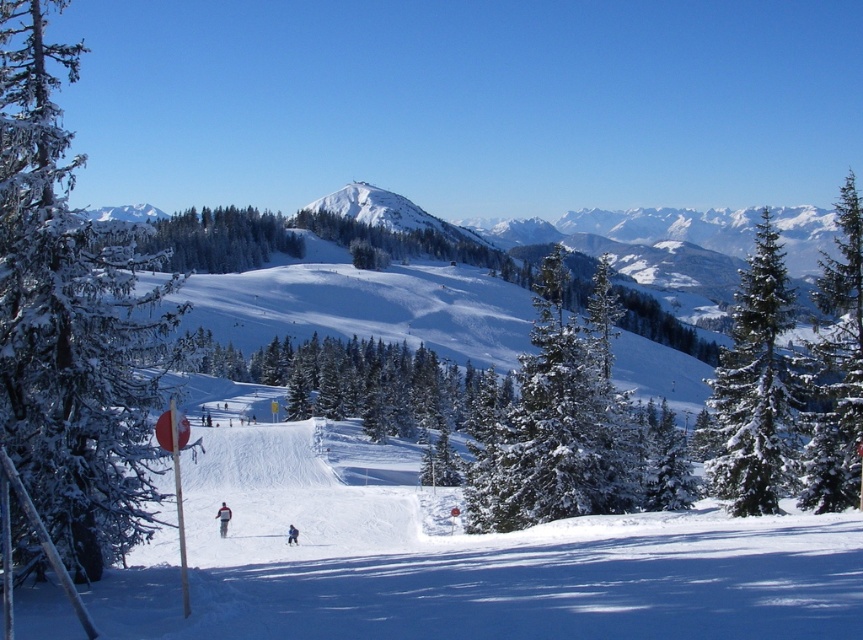
Question: Estimate the real-world distances between objects in this image. Which object is closer to the snow-covered evergreen tree at left?

Choices:
 (A) blue fabric jacket at center
 (B) green textured pine at center
 (C) red fabric jacket at center

Answer: (C)

Question: Estimate the real-world distances between objects in this image. Which object is farther from the green matte tree at center?

Choices:
 (A) green textured pine tree at right
 (B) blue fabric jacket at center

Answer: (A)

Question: Can you confirm if green snow-covered tree at right is positioned above blue fabric jacket at center?

Choices:
 (A) yes
 (B) no

Answer: (A)

Question: Can you confirm if green matte tree at center is wider than red fabric jacket at center?

Choices:
 (A) yes
 (B) no

Answer: (A)

Question: Is green matte tree at center positioned at the back of blue fabric jacket at center?

Choices:
 (A) yes
 (B) no

Answer: (B)

Question: Based on their relative distances, which object is nearer to the snow-covered evergreen tree at left?

Choices:
 (A) green snow-covered tree at right
 (B) red fabric jacket at center
 (C) blue fabric jacket at center

Answer: (B)